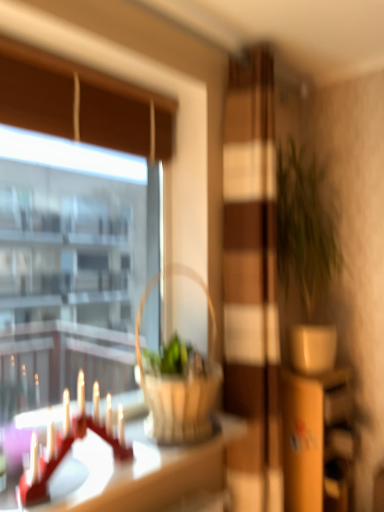
Question: Is green matte plant at right inside the boundaries of white glossy table at lower left, or outside?

Choices:
 (A) outside
 (B) inside

Answer: (A)

Question: Relative to white glossy table at lower left, is green matte plant at right in front or behind?

Choices:
 (A) behind
 (B) front

Answer: (A)

Question: Based on their relative distances, which object is nearer to the wooden dresser at right?

Choices:
 (A) woven wood picnic basket at center
 (B) matte red candle holder at left
 (C) wooden screen door at center
 (D) transparent glass window at upper left
 (E) white glossy table at lower left

Answer: (C)

Question: Which object is positioned farthest from the wooden dresser at right?

Choices:
 (A) wooden screen door at center
 (B) white glossy table at lower left
 (C) transparent glass window at upper left
 (D) woven wood picnic basket at center
 (E) green matte plant at right

Answer: (C)